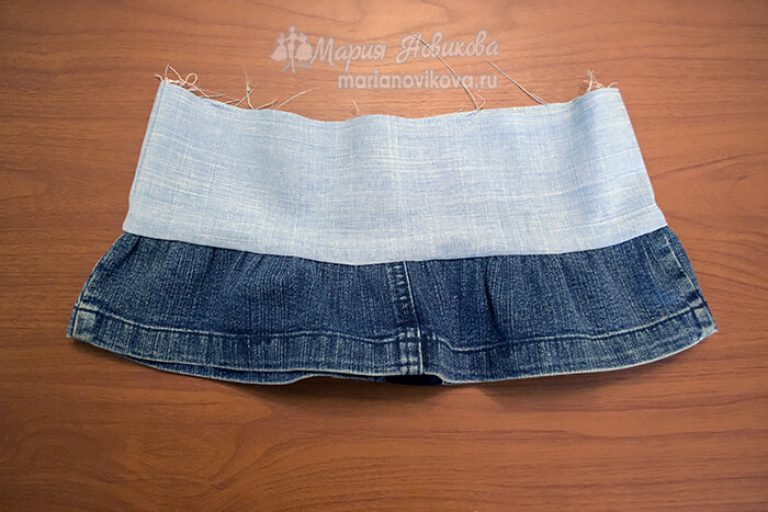
Where is `table`? table is located at coordinates (677, 445).